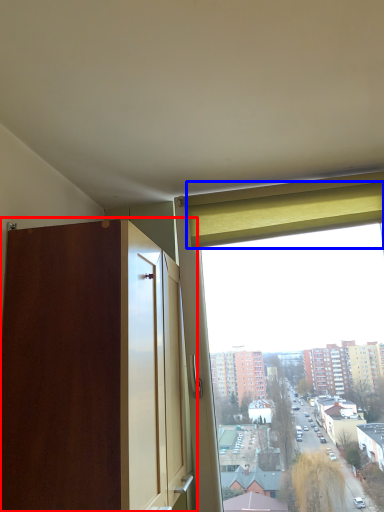
Question: Which object appears farthest to the camera in this image, dresser (highlighted by a red box) or curtain (highlighted by a blue box)?

Choices:
 (A) dresser
 (B) curtain

Answer: (B)